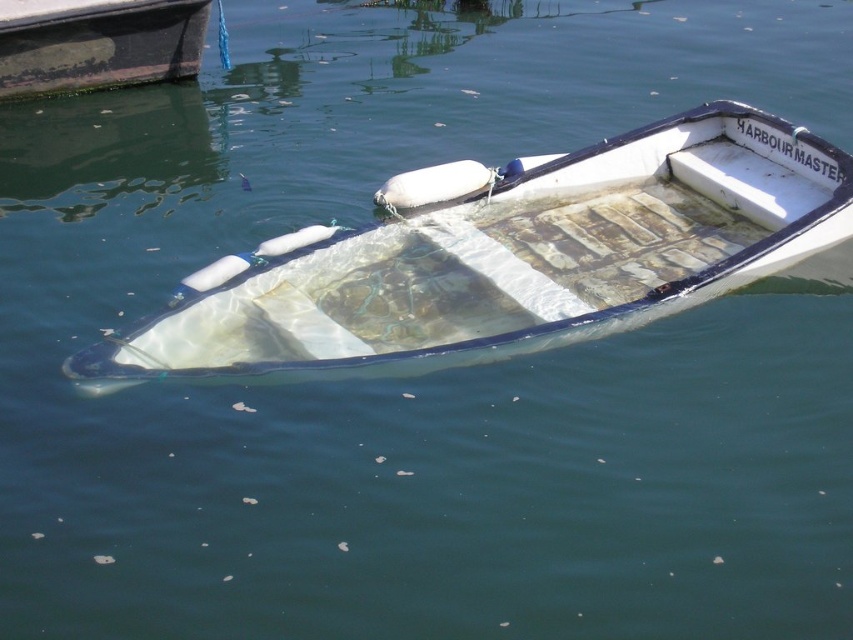
The height and width of the screenshot is (640, 853). Find the location of `transparent plastic boat at center`. transparent plastic boat at center is located at coordinates (503, 259).